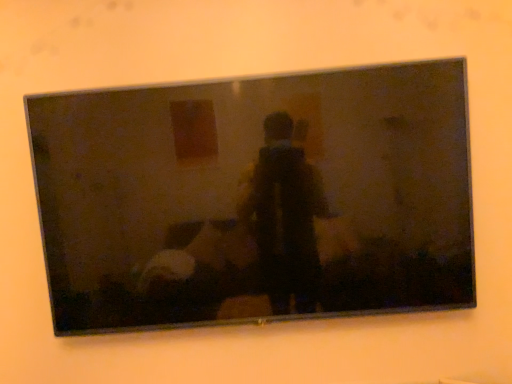
What do you see at coordinates (256, 198) in the screenshot?
I see `matte black frame at center` at bounding box center [256, 198].

I want to click on matte black frame at center, so click(256, 198).

I want to click on matte black frame at center, so click(x=256, y=198).